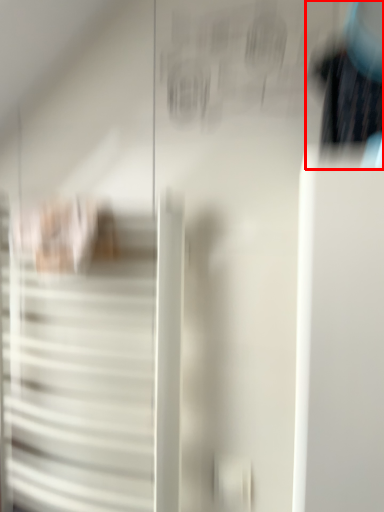
Question: Where is couple (annotated by the red box) located in relation to door in the image?

Choices:
 (A) right
 (B) left

Answer: (A)